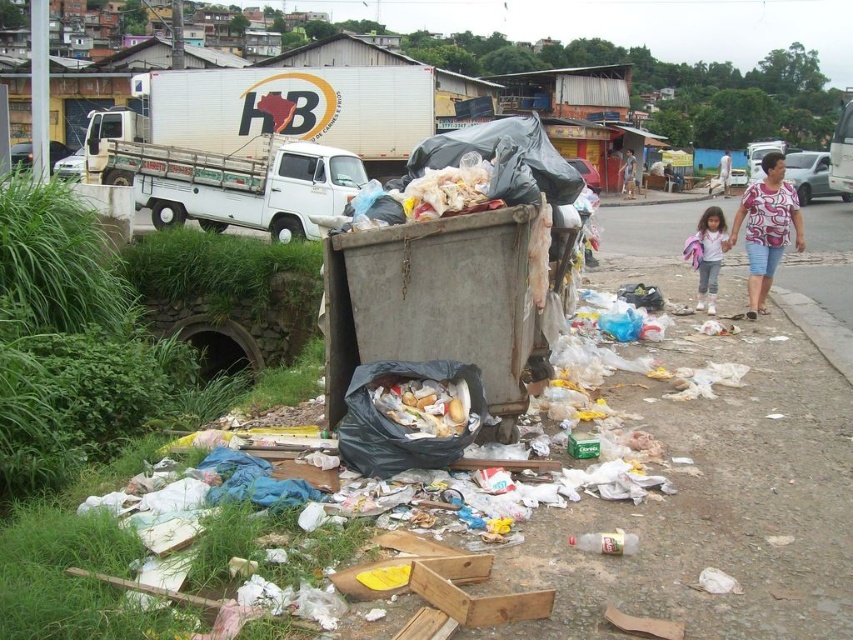
Question: Can you confirm if pink fabric at lower center is bigger than light brown fabric dress at lower right?

Choices:
 (A) yes
 (B) no

Answer: (B)

Question: Which point appears closest to the camera in this image?

Choices:
 (A) (833, 460)
 (B) (787, 192)

Answer: (A)

Question: Is white matte truck at upper center thinner than pink fabric at lower center?

Choices:
 (A) yes
 (B) no

Answer: (B)

Question: Which is farther from the light brown shorts at lower right?

Choices:
 (A) pink fabric at lower center
 (B) white printed shirt at right
 (C) white matte truck at left
 (D) light brown fabric dress at lower right

Answer: (A)

Question: Which object appears farthest from the camera in this image?

Choices:
 (A) light brown shorts at lower right
 (B) white matte truck at left
 (C) white printed shirt at right
 (D) gray concrete pavement at lower left

Answer: (A)

Question: Can you confirm if gray concrete pavement at lower left is positioned below pink fabric at lower center?

Choices:
 (A) no
 (B) yes

Answer: (B)